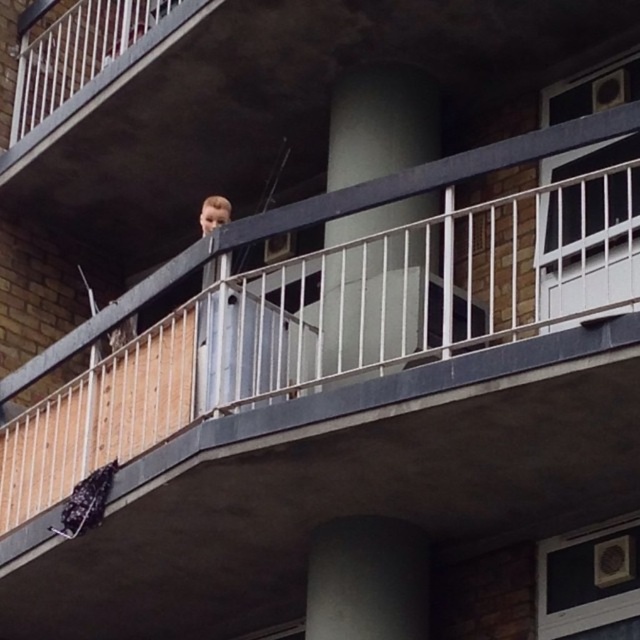
Which is behind, point (413, 108) or point (333, 630)?

Point (413, 108)

Looking at this image, does white smooth pillar at center appear under smooth concrete pillar at center?

Actually, white smooth pillar at center is above smooth concrete pillar at center.

Who is more distant from viewer, (355, 312) or (371, 568)?

The point (355, 312) is more distant.

Where is `white smooth pillar at center`? This screenshot has height=640, width=640. white smooth pillar at center is located at coordinates (372, 300).

Does point (349, 516) lie behind point (212, 209)?

No.

Locate an element on the screen. smooth concrete pillar at center is located at coordinates (368, 580).

What are the coordinates of `smooth concrete pillar at center` in the screenshot? It's located at (368, 580).

Between white smooth pillar at center and blonde hair at center, which one appears on the left side from the viewer's perspective?

blonde hair at center

Can you confirm if white smooth pillar at center is positioned below blonde hair at center?

Yes.

This screenshot has height=640, width=640. Identify the location of white smooth pillar at center. (372, 300).